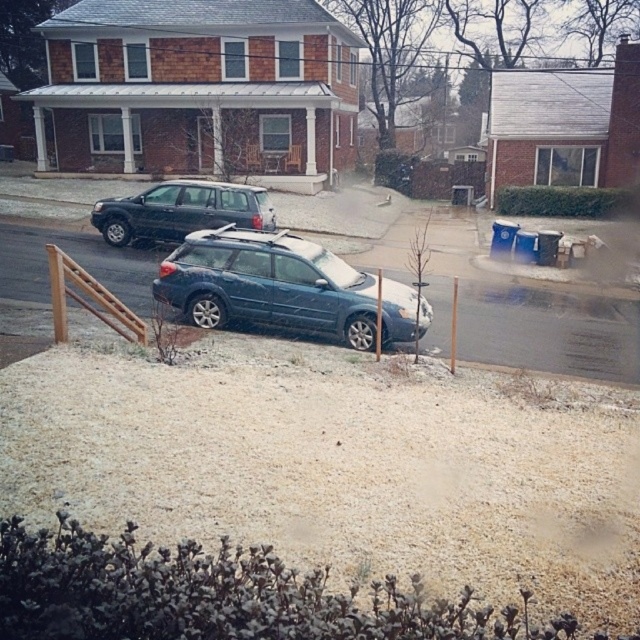
Question: Is satin blue station wagon at center positioned before matte black suv at center?

Choices:
 (A) yes
 (B) no

Answer: (A)

Question: Which point appears closest to the camera in this image?

Choices:
 (A) (246, 209)
 (B) (353, 324)

Answer: (B)

Question: Which of the following is the farthest from the observer?

Choices:
 (A) satin blue station wagon at center
 (B) matte black suv at center

Answer: (B)

Question: Does satin blue station wagon at center have a smaller size compared to matte black suv at center?

Choices:
 (A) yes
 (B) no

Answer: (B)

Question: Does satin blue station wagon at center appear on the left side of matte black suv at center?

Choices:
 (A) no
 (B) yes

Answer: (A)